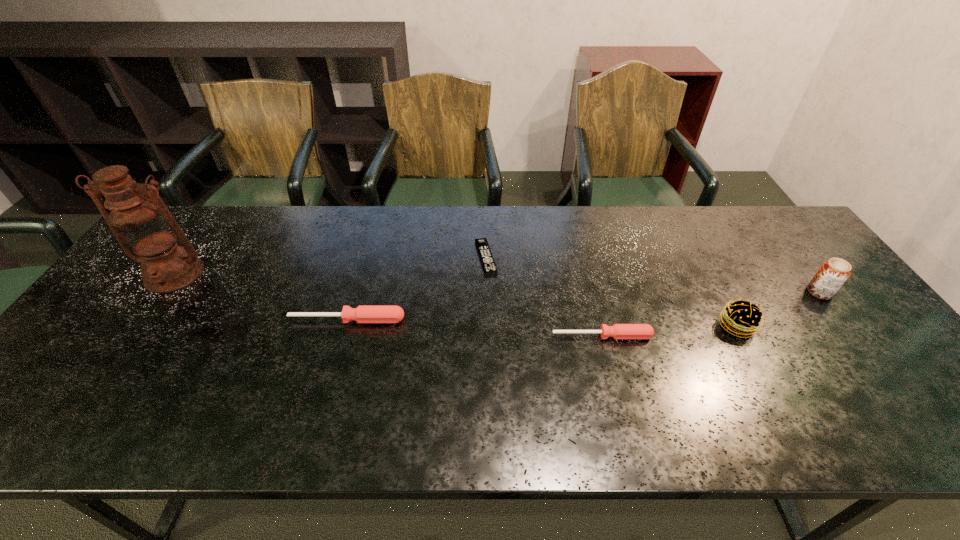
Please point a spot on the right to add another screwdriver. Please provide its 2D coordinates. Your answer should be formatted as a tuple, i.e. [(x, y)], where the tuple contains the x and y coordinates of a point satisfying the conditions above.

[(876, 354)]